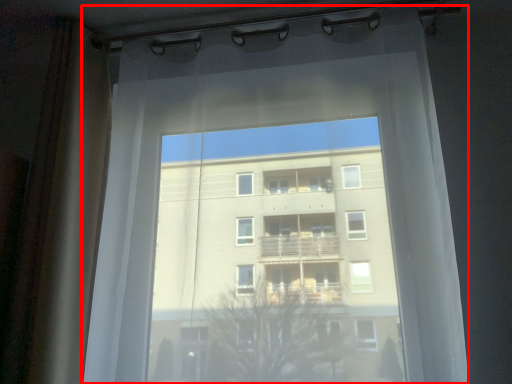
Question: From the image's perspective, what is the correct spatial relationship of curtain (annotated by the red box) in relation to shower curtain?

Choices:
 (A) above
 (B) below

Answer: (B)